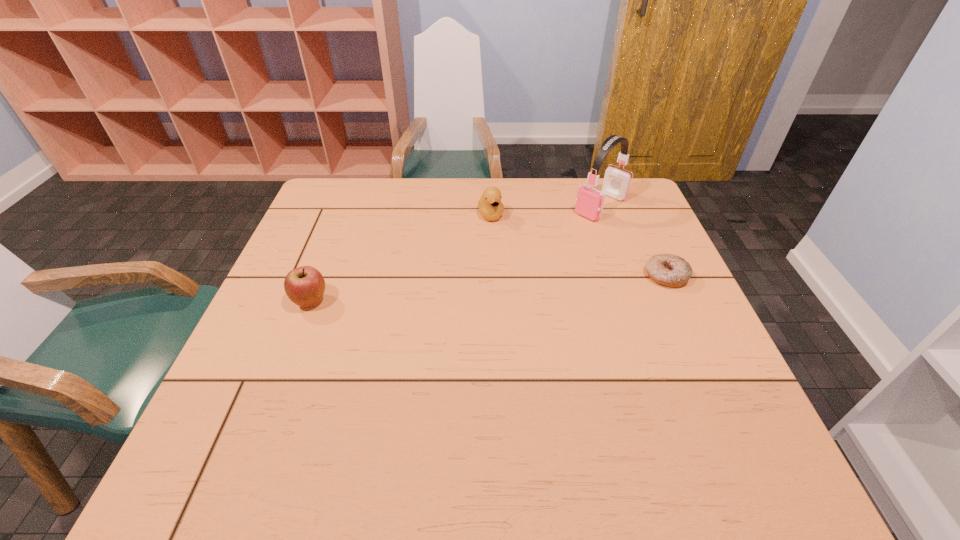
Where is `blank region between the doughnut and the duckling`? The width and height of the screenshot is (960, 540). blank region between the doughnut and the duckling is located at coordinates [x=578, y=245].

This screenshot has height=540, width=960. I want to click on empty space that is in between the shortest object and the second object from left to right, so [578, 245].

Locate an element on the screen. This screenshot has height=540, width=960. unoccupied position between the shortest object and the tallest object is located at coordinates (634, 241).

Find the location of a particular element. Image resolution: width=960 pixels, height=540 pixels. empty location between the shortest object and the duckling is located at coordinates (578, 245).

You are a GUI agent. You are given a task and a screenshot of the screen. Output one action in this format:
    pyautogui.click(x=<x>, y=<y>)
    Task: Click on the vacant area between the second object from left to right and the apple
    
    Given the screenshot: What is the action you would take?
    pyautogui.click(x=400, y=258)

The height and width of the screenshot is (540, 960). Find the location of `object that ranks as the third closest to the third object from right to left`. object that ranks as the third closest to the third object from right to left is located at coordinates (304, 286).

Find the location of a particular element. The height and width of the screenshot is (540, 960). object that stands as the second closest to the duckling is located at coordinates (670, 270).

Find the location of a particular element. The height and width of the screenshot is (540, 960). free space in the image that satisfies the following two spatial constraints: 1. on the back side of the apple; 2. on the right side of the earphone is located at coordinates (348, 206).

Locate an element on the screen. free space that satisfies the following two spatial constraints: 1. on the front side of the tallest object; 2. on the right side of the doughnut is located at coordinates click(625, 276).

Image resolution: width=960 pixels, height=540 pixels. What are the coordinates of `free location that satisfies the following two spatial constraints: 1. on the back side of the leftmost object; 2. on the right side of the tallest object` in the screenshot? It's located at (348, 206).